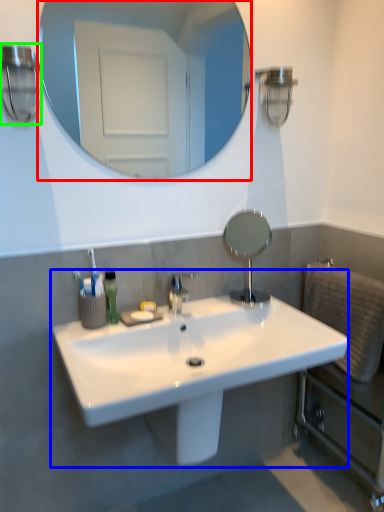
Question: Based on their relative distances, which object is nearer to mirror (highlighted by a red box)? Choose from sink (highlighted by a blue box) and light fixture (highlighted by a green box).

Choices:
 (A) sink
 (B) light fixture

Answer: (B)